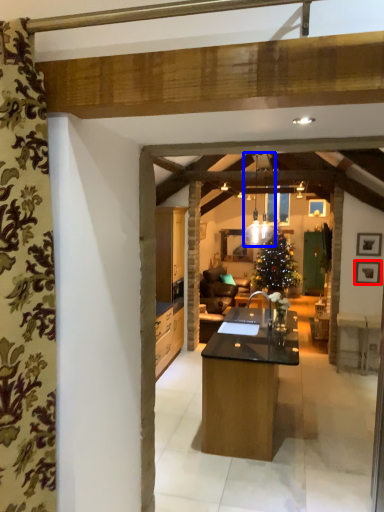
Question: Which object is further to the camera taking this photo, picture frame (highlighted by a red box) or light fixture (highlighted by a blue box)?

Choices:
 (A) picture frame
 (B) light fixture

Answer: (A)